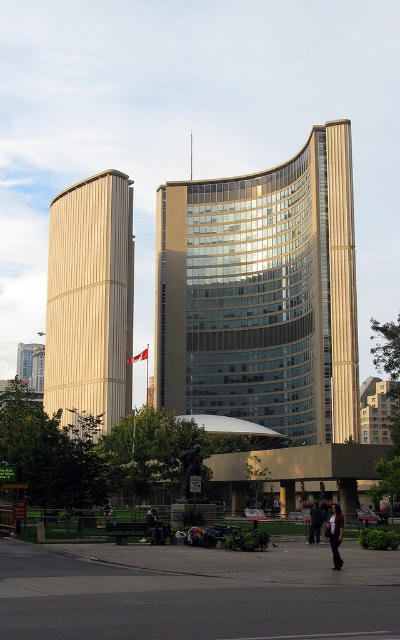
You are standing in front of the modern architectural structure. You want to place a new bench between the matte gold tower at left and the red fabric flag at center. Based on their positions, which object will the bench be closer to?

The bench will be closer to the matte gold tower at left because it is closer to the viewer than the red fabric flag at center.

You are a fashion designer observing a model wearing both dark gray fabric pants at lower center and dark blue jeans at lower center. Which clothing item is covering the other?

The dark gray fabric pants at lower center are positioned over the dark blue jeans at lower center, meaning the gray pants are covering the blue jeans.